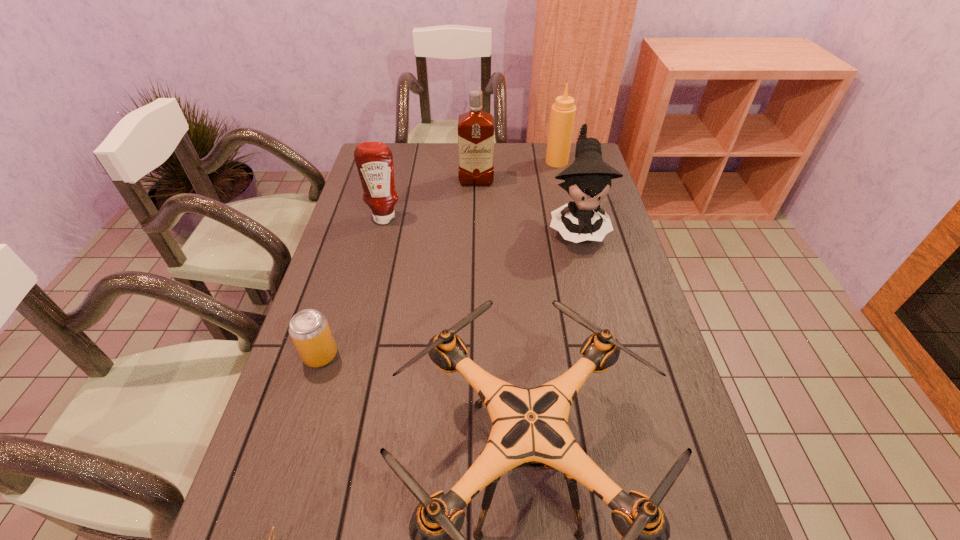
Identify the location of free space located on the back of the second shortest object. The width and height of the screenshot is (960, 540). (353, 249).

Identify the location of liquor present at the far edge. (475, 128).

I want to click on condiment present at the far edge, so click(563, 111).

The image size is (960, 540). What are the coordinates of `condiment positioned at the left edge` in the screenshot? It's located at pos(374,160).

Where is `pop (soda) that is at the left edge`? pop (soda) that is at the left edge is located at coordinates (309, 329).

The width and height of the screenshot is (960, 540). In order to click on condiment at the right edge in this screenshot , I will do `click(563, 111)`.

The width and height of the screenshot is (960, 540). In order to click on doll that is at the right edge in this screenshot , I will do `click(588, 180)`.

Where is `object positioned at the far right corner`? The image size is (960, 540). object positioned at the far right corner is located at coordinates (563, 111).

Where is `free space at the far edge`? free space at the far edge is located at coordinates (415, 171).

This screenshot has height=540, width=960. In order to click on free spot at the left edge of the desktop in this screenshot , I will do `click(280, 414)`.